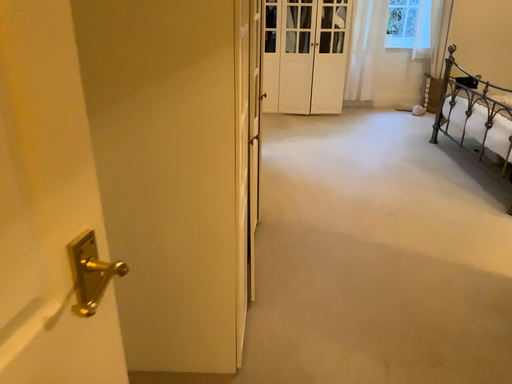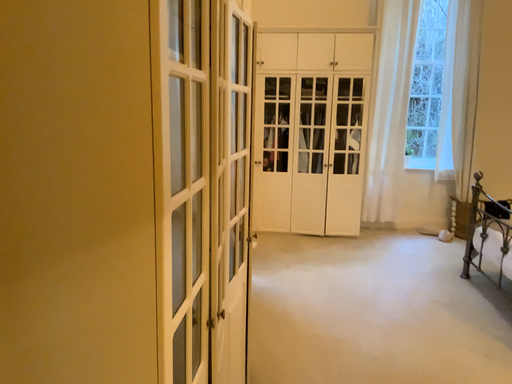
Question: Which way did the camera rotate in the video?

Choices:
 (A) rotated downward
 (B) rotated upward

Answer: (B)